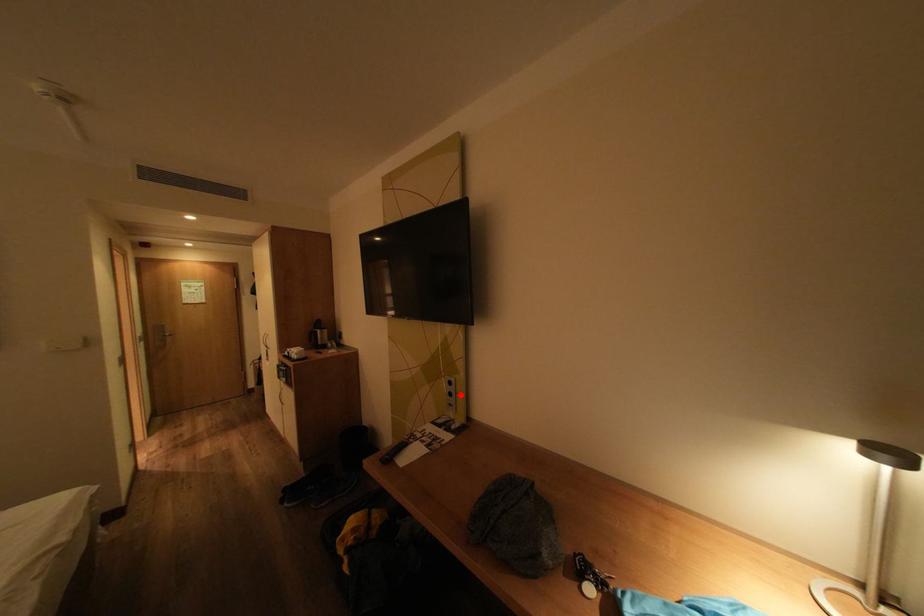
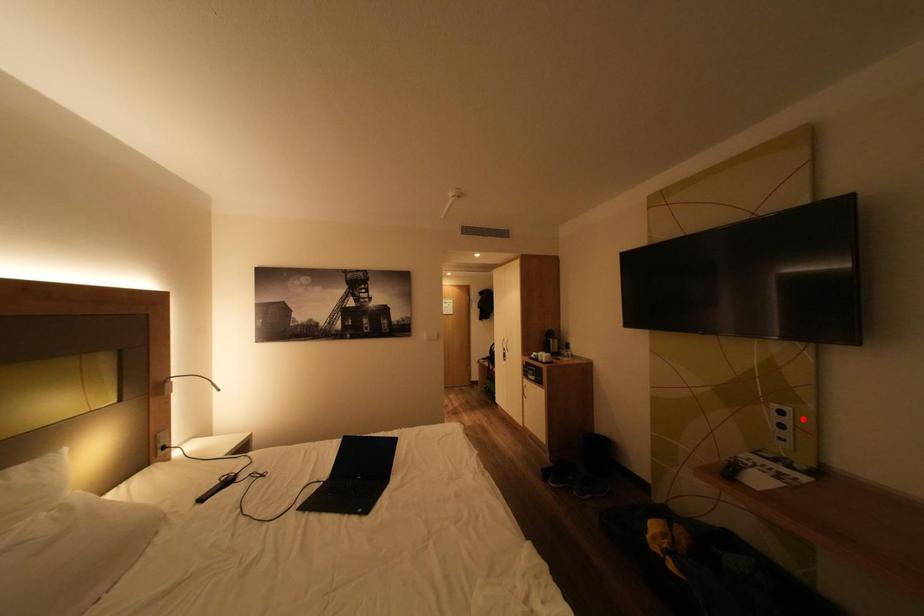
I am providing you with two images of the same scene from different viewpoints. A red point is marked on the first image and another point is marked on the second image. Are the points marked in image1 and image2 representing the same 3D position?

No